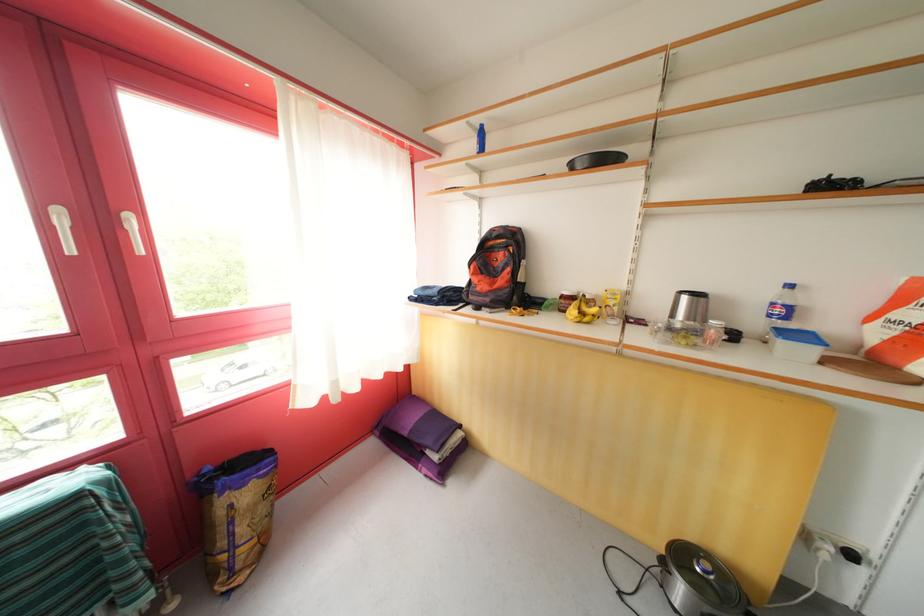
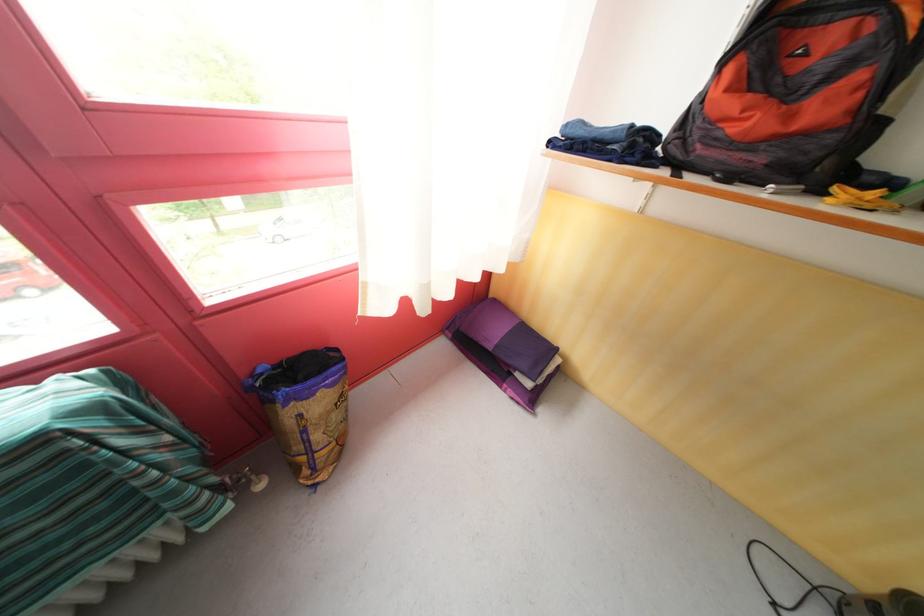
Question: The first image is from the beginning of the video and the second image is from the end. How did the camera likely rotate when shooting the video?

Choices:
 (A) Left
 (B) Right
 (C) Up
 (D) Down

Answer: (D)